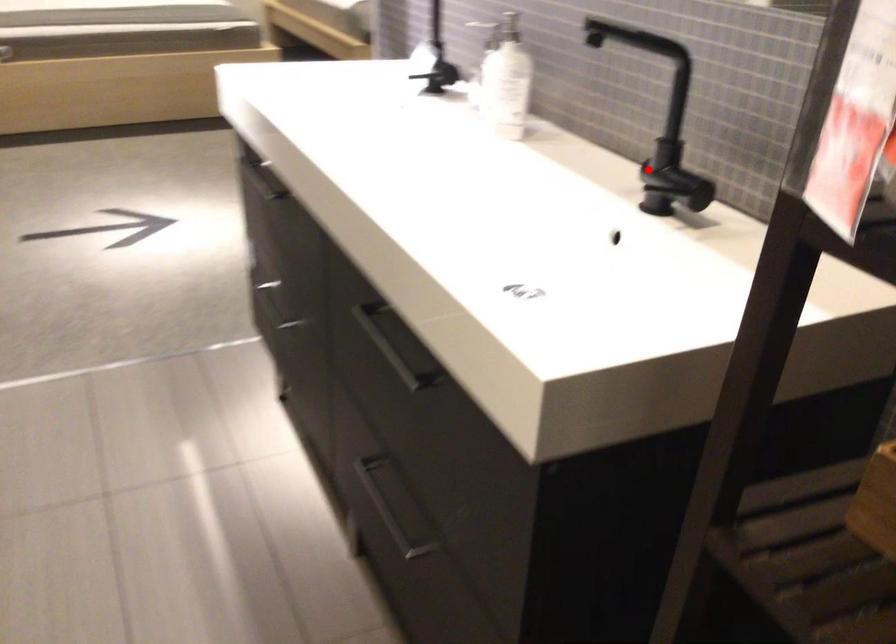
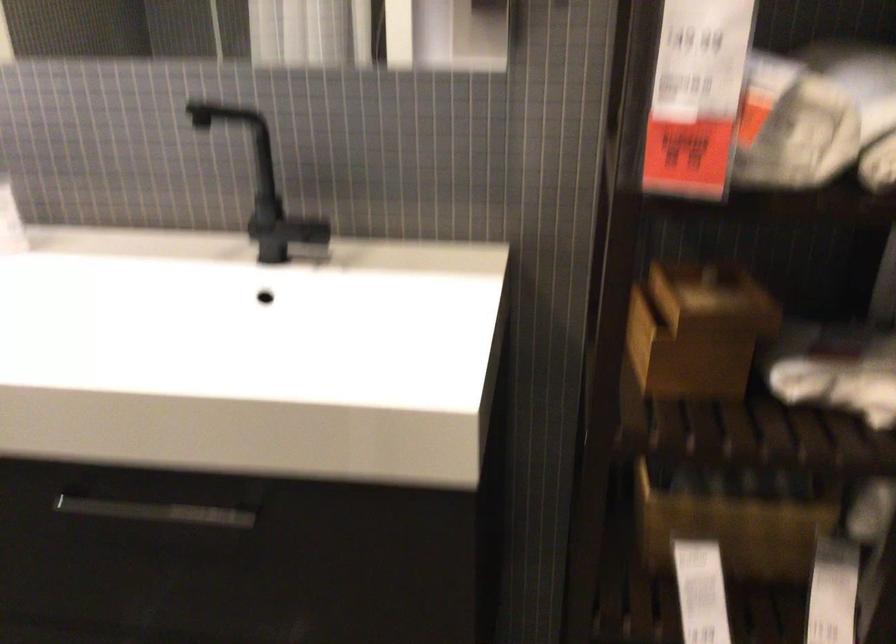
Find the pixel in the second image that matches the highlighted location in the first image.

(268, 227)